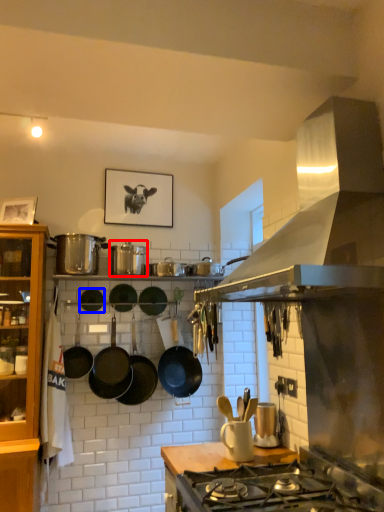
Question: Which object appears closest to the camera in this image, appliance (highlighted by a red box) or wok (highlighted by a blue box)?

Choices:
 (A) appliance
 (B) wok

Answer: (A)